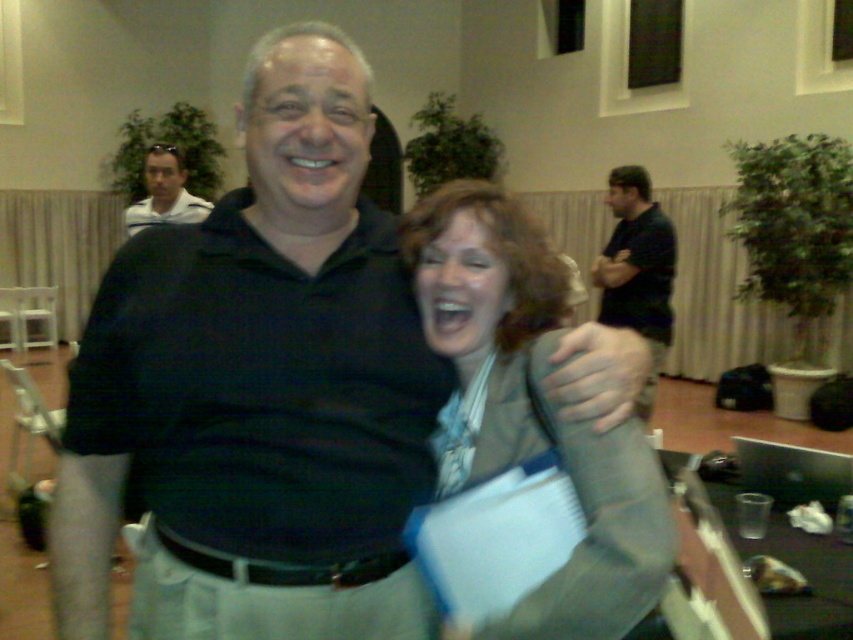
Question: Does black matte shirt at center come behind matte gray blazer at center?

Choices:
 (A) no
 (B) yes

Answer: (B)

Question: Which of the following is the farthest from the observer?

Choices:
 (A) (280, 68)
 (B) (161, 154)
 (C) (634, 481)

Answer: (B)

Question: Does black shirt at center have a smaller size compared to matte white shirt at upper left?

Choices:
 (A) yes
 (B) no

Answer: (B)

Question: Estimate the real-world distances between objects in this image. Which object is closer to the matte white shirt at upper left?

Choices:
 (A) matte gray blazer at center
 (B) black shirt at center
 (C) black matte shirt at center

Answer: (B)

Question: Is black matte shirt at center to the right of matte gray blazer at center from the viewer's perspective?

Choices:
 (A) yes
 (B) no

Answer: (B)

Question: Considering the real-world distances, which object is closest to the matte gray blazer at center?

Choices:
 (A) black matte shirt at center
 (B) matte white shirt at upper left
 (C) black shirt at center

Answer: (A)